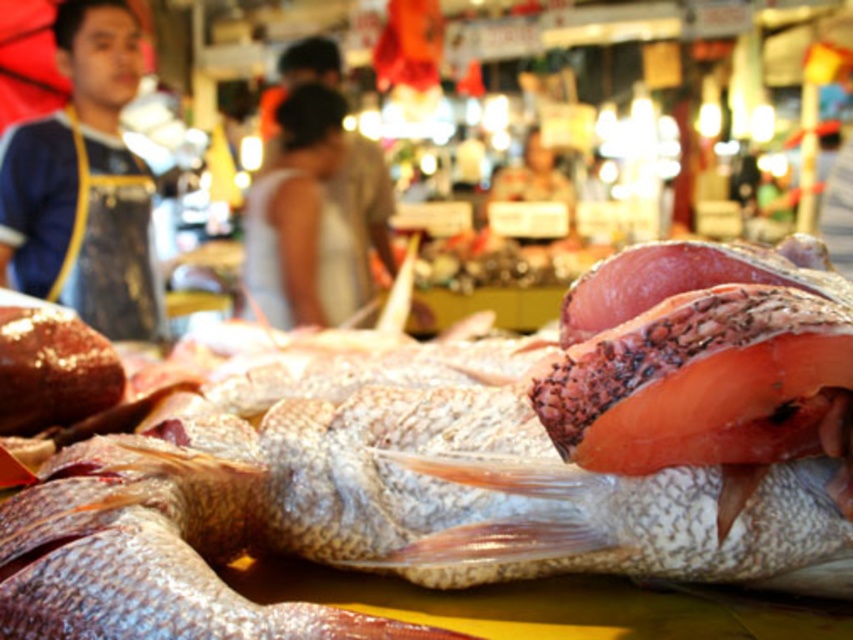
You are a customer at the fish market and want to pick up two items located at the coordinates point (x=91, y=163) and point (x=302, y=168). Which item should you pick up first if you want to start from the closest one to you?

You should pick up the item at point (x=91, y=163) first because it is closer to you than the item at point (x=302, y=168), as point (x=91, y=163) is in front of point (x=302, y=168).

From the picture: You are a photographer who wants to capture the blue apron at left and the white fabric dress at center in a single photo. Based on their positions, which one will appear closer to the bottom of the photo?

The blue apron at left is below the white fabric dress at center, so it will appear closer to the bottom of the photo.

From the picture: You are a photographer who wants to capture a photo of the blue apron at left and the white fabric dress at center. Based on their positions, which one is closer to the left edge of the frame?

The blue apron at left is to the left of the white fabric dress at center, so the blue apron at left is closer to the left edge of the frame.